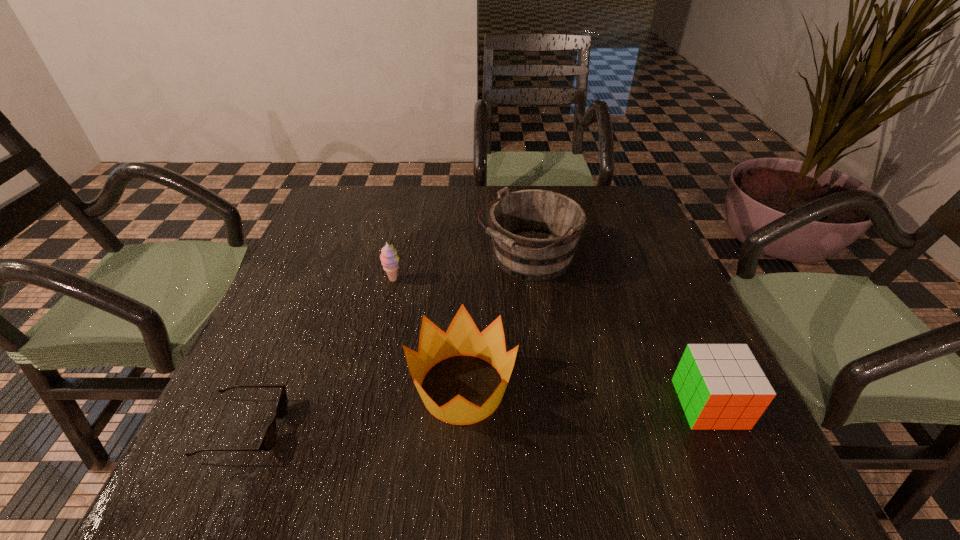
Identify which object is the third nearest to the sherbert. Please provide its 2D coordinates. Your answer should be formatted as a tuple, i.e. [(x, y)], where the tuple contains the x and y coordinates of a point satisfying the conditions above.

[(269, 438)]

I want to click on object that is the fourth closest to the second object from left to right, so click(720, 386).

Where is `free spot that satisfies the following two spatial constraints: 1. on the front side of the crown; 2. on the front lenses of the shortest object`? This screenshot has width=960, height=540. free spot that satisfies the following two spatial constraints: 1. on the front side of the crown; 2. on the front lenses of the shortest object is located at coordinates (461, 428).

At what (x,y) coordinates should I click in order to perform the action: click on vacant space that satisfies the following two spatial constraints: 1. on the front side of the crown; 2. on the front lenses of the leftmost object. Please return your answer as a coordinate pair (x, y). Image resolution: width=960 pixels, height=540 pixels. Looking at the image, I should click on (461, 428).

At what (x,y) coordinates should I click in order to perform the action: click on free space that satisfies the following two spatial constraints: 1. on the front side of the tallest object; 2. on the right side of the cube. Please return your answer as a coordinate pair (x, y). Image resolution: width=960 pixels, height=540 pixels. Looking at the image, I should click on (548, 404).